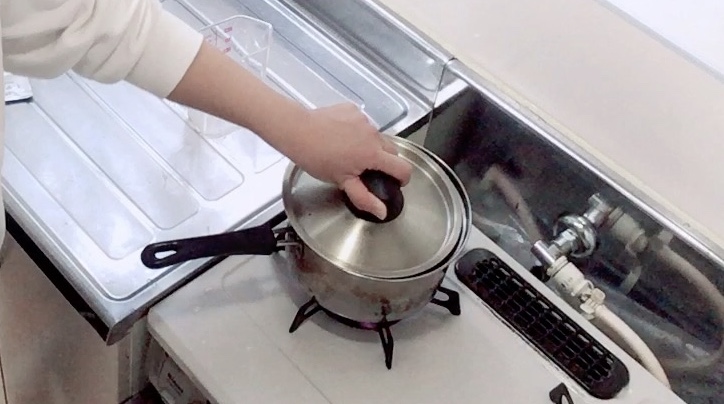
What are the coordinates of `black handle` in the screenshot? It's located at (244, 241).